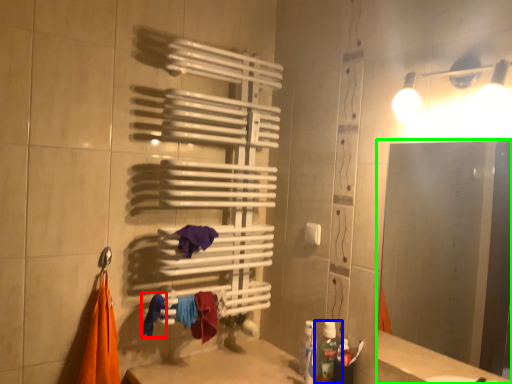
Question: Which is farther away from clothe (highlighted by a red box)? bottle (highlighted by a blue box) or mirror (highlighted by a green box)?

Choices:
 (A) bottle
 (B) mirror

Answer: (B)